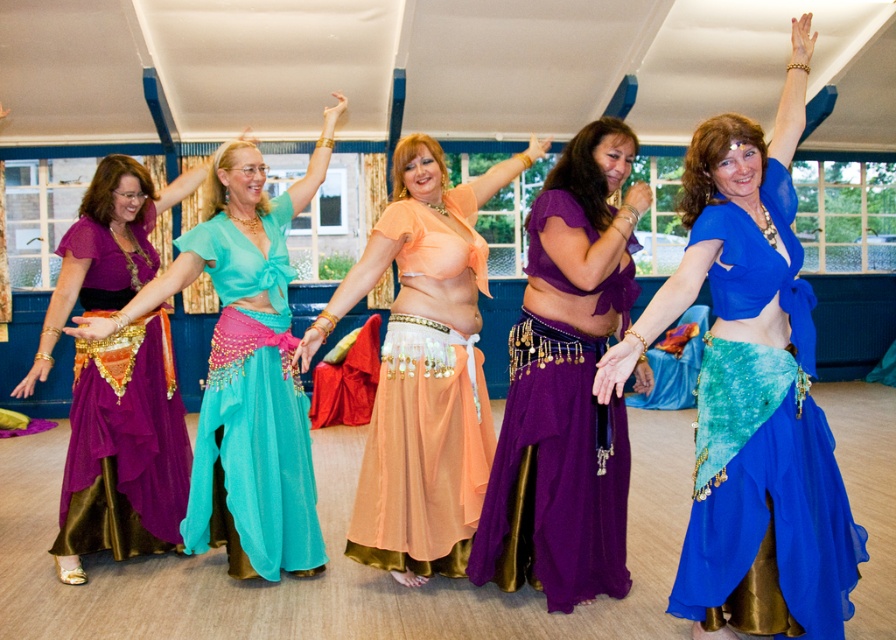
You are a photographer positioned at the front of the belly dancing class. You want to capture a photo that includes both the matte purple skirt at left and the teal chiffon skirt at center. Which skirt will appear closer to the camera in the photo?

The matte purple skirt at left will appear closer to the camera because it is in front of the teal chiffon skirt at center.

You are standing at the entrance of the belly dancing class and want to move towards the point labeled as point (557, 166). However, there is an obstacle at point (250, 548). Will you encounter the obstacle before reaching your destination?

Since point (557, 166) is in front of point (250, 548), you will reach point (557, 166) before encountering the obstacle at point (250, 548).

You are a photographer positioned at the front of the belly dancing class. You want to capture a photo where the blue velvet skirt at center is clearly visible without being blocked. Should you adjust your position to avoid the matte purple skirt at left?

The blue velvet skirt at center is in front of the matte purple skirt at left, so it is already visible and not blocked. No adjustment is needed.